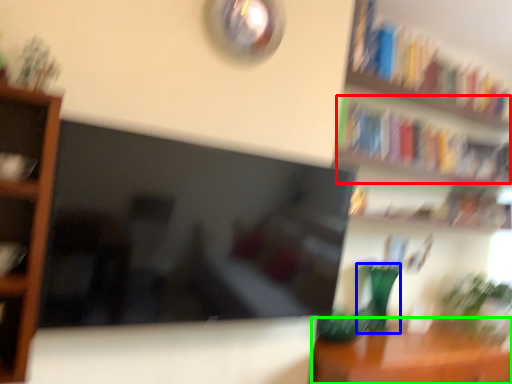
Question: Based on their relative distances, which object is farther from book (highlighted by a red box)? Choose from glass vase (highlighted by a blue box) and table (highlighted by a green box).

Choices:
 (A) glass vase
 (B) table

Answer: (B)